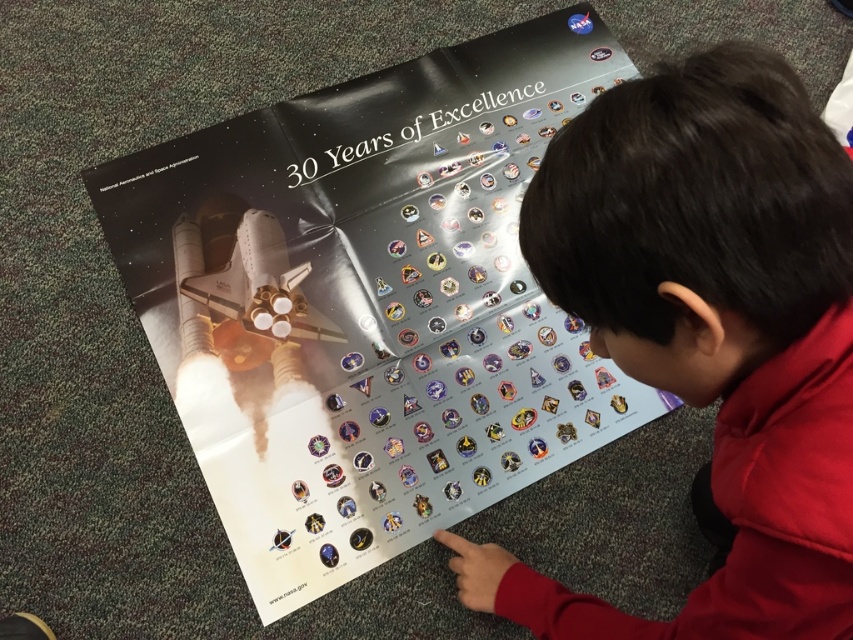
Which is in front, point (509, 346) or point (761, 477)?

Point (761, 477) is in front.

Find the location of a particular element. The height and width of the screenshot is (640, 853). metallic silver poster at center is located at coordinates (369, 301).